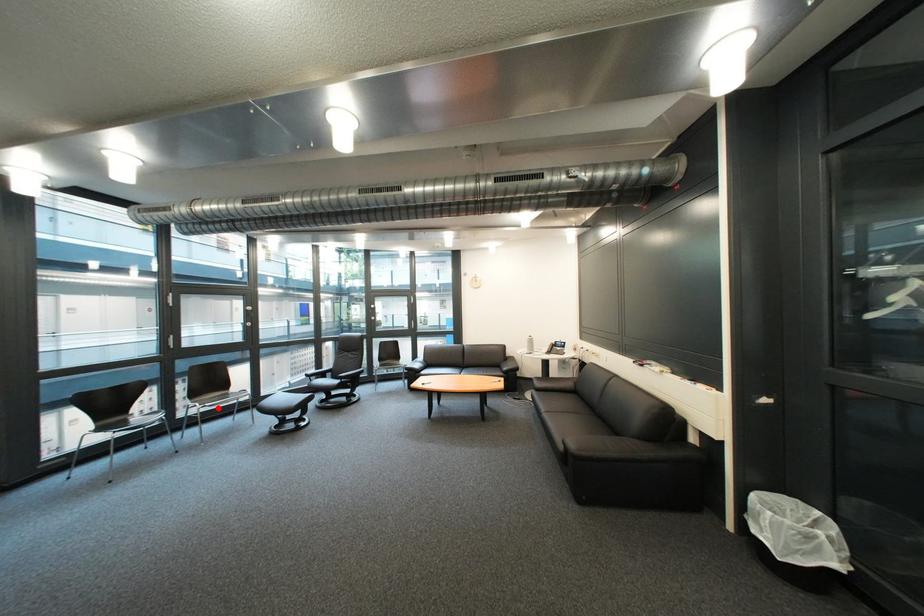
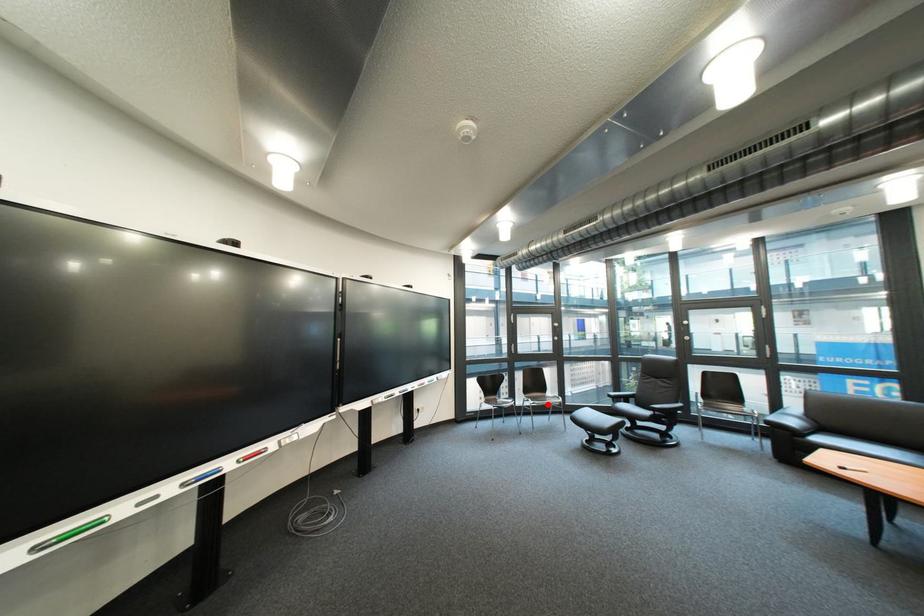
I am providing you with two images of the same scene from different viewpoints. A red point is marked on the first image and another point is marked on the second image. Is the marked point in image1 the same physical position as the marked point in image2?

Yes